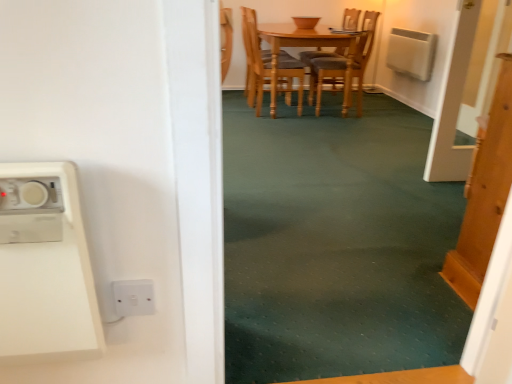
What do you see at coordinates (49, 284) in the screenshot? I see `white plastic microwave at left` at bounding box center [49, 284].

The image size is (512, 384). In order to click on green carpet at center in this screenshot , I will do `click(335, 244)`.

Where is `light brown wooden table at center`? The height and width of the screenshot is (384, 512). light brown wooden table at center is located at coordinates (301, 58).

The height and width of the screenshot is (384, 512). I want to click on light brown wooden chair at center, so click(x=268, y=69).

Consider the image. From a real-world perspective, who is located higher, white plastic microwave at left or light brown wooden chair at center?

From a 3D spatial view, white plastic microwave at left is above.

Is white plastic microwave at left positioned far away from light brown wooden chair at center?

white plastic microwave at left is positioned a significant distance from light brown wooden chair at center.

How different are the orientations of white plastic microwave at left and light brown wooden chair at center in degrees?

There is a 90.5-degree angle between the facing directions of white plastic microwave at left and light brown wooden chair at center.

Where is `chair lying behind the white plastic microwave at left`? chair lying behind the white plastic microwave at left is located at coordinates (268, 69).

Between point (127, 309) and point (471, 298), which one is positioned behind?

The point (471, 298) is more distant.

Considering the sizes of objects white plastic switch at lower center and wooden door at right in the image provided, who is shorter, white plastic switch at lower center or wooden door at right?

white plastic switch at lower center.

Does white plastic switch at lower center have a greater width compared to wooden door at right?

No, white plastic switch at lower center is not wider than wooden door at right.

Is white plastic switch at lower center directly adjacent to wooden door at right?

No, white plastic switch at lower center is not beside wooden door at right.

Does wooden door at right have a greater width compared to light brown wooden table at center?

Incorrect, the width of wooden door at right does not surpass that of light brown wooden table at center.

Locate an element on the screen. door on the right of light brown wooden table at center is located at coordinates (484, 193).

Is wooden door at right oriented towards light brown wooden table at center?

No, wooden door at right is not aimed at light brown wooden table at center.

Can you see light brown wooden chair at center touching light brown wooden table at center?

No, light brown wooden chair at center is not with light brown wooden table at center.

Between light brown wooden chair at center and light brown wooden table at center, which one appears on the left side from the viewer's perspective?

From the viewer's perspective, light brown wooden chair at center appears more on the left side.

Can you tell me how much light brown wooden chair at center and light brown wooden table at center differ in facing direction?

The angle between the facing direction of light brown wooden chair at center and the facing direction of light brown wooden table at center is 89.7 degrees.

Is light brown wooden chair at center oriented towards light brown wooden table at center?

Yes, light brown wooden chair at center faces towards light brown wooden table at center.

Based on the photo, is white plastic microwave at left facing away from green carpet at center?

white plastic microwave at left does not have its back to green carpet at center.

Can green carpet at center be found inside white plastic microwave at left?

No, green carpet at center is not inside white plastic microwave at left.

From the image's perspective, between white plastic microwave at left and green carpet at center, which one is located above?

green carpet at center, from the image's perspective.

Measure the distance between white plastic microwave at left and green carpet at center.

A distance of 3.71 feet exists between white plastic microwave at left and green carpet at center.

Does light brown wooden chair at center turn towards white plastic microwave at left?

No, light brown wooden chair at center is not facing towards white plastic microwave at left.

Can you confirm if light brown wooden chair at center is wider than white plastic microwave at left?

Yes, light brown wooden chair at center is wider than white plastic microwave at left.

Locate an element on the screen. appliance on the left of the light brown wooden chair at center is located at coordinates (49, 284).

Which of these two, light brown wooden chair at center or white plastic microwave at left, is smaller?

white plastic microwave at left is smaller.

Is light brown wooden table at center closer to the viewer compared to light brown wooden chair at center?

Yes, light brown wooden table at center is closer to the camera.

How different are the orientations of light brown wooden table at center and light brown wooden chair at center in degrees?

The angle between the facing direction of light brown wooden table at center and the facing direction of light brown wooden chair at center is 89.7 degrees.

Is light brown wooden chair at center at the back of light brown wooden table at center?

No, light brown wooden chair at center is not at the back of light brown wooden table at center.

Considering the relative sizes of light brown wooden table at center and light brown wooden chair at center in the image provided, is light brown wooden table at center bigger than light brown wooden chair at center?

Correct, light brown wooden table at center is larger in size than light brown wooden chair at center.

The height and width of the screenshot is (384, 512). I want to click on appliance in front of the light brown wooden chair at center, so click(49, 284).

Identify the location of electric outlet below the wooden door at right (from the image's perspective). (134, 297).

Considering their positions, is light brown wooden chair at center positioned further to green carpet at center than white plastic microwave at left?

Based on the image, light brown wooden chair at center appears to be further to green carpet at center.

Looking at the image, which one is located further to green carpet at center, white plastic microwave at left or wooden door at right?

white plastic microwave at left lies further to green carpet at center than the other object.

Looking at the image, which one is located further to green carpet at center, light brown wooden table at center or white plastic switch at lower center?

light brown wooden table at center is further to green carpet at center.

Based on their spatial positions, is light brown wooden chair at center or green carpet at center further from white plastic microwave at left?

light brown wooden chair at center lies further to white plastic microwave at left than the other object.

Based on their spatial positions, is wooden door at right or light brown wooden table at center further from light brown wooden chair at center?

Among the two, wooden door at right is located further to light brown wooden chair at center.

From the image, which object appears to be farther from light brown wooden table at center, white plastic microwave at left or white plastic switch at lower center?

white plastic switch at lower center is positioned further to the anchor light brown wooden table at center.

Based on their spatial positions, is white plastic switch at lower center or light brown wooden table at center closer to white plastic microwave at left?

white plastic switch at lower center is positioned closer to the anchor white plastic microwave at left.

Estimate the real-world distances between objects in this image. Which object is closer to light brown wooden table at center, light brown wooden chair at center or white plastic microwave at left?

The object closer to light brown wooden table at center is light brown wooden chair at center.

Locate an element on the screen. This screenshot has height=384, width=512. door located between white plastic switch at lower center and light brown wooden chair at center in the depth direction is located at coordinates (484, 193).

Image resolution: width=512 pixels, height=384 pixels. I want to click on electric outlet between white plastic microwave at left and light brown wooden table at center from front to back, so click(134, 297).

I want to click on electric outlet situated between white plastic microwave at left and wooden door at right from left to right, so click(x=134, y=297).

Where is `plain positioned between white plastic switch at lower center and light brown wooden table at center from near to far`? The width and height of the screenshot is (512, 384). plain positioned between white plastic switch at lower center and light brown wooden table at center from near to far is located at coordinates (335, 244).